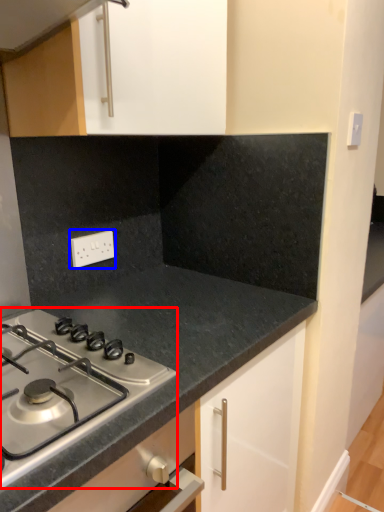
Question: Which point is closer to the camera, gas stove (highlighted by a red box) or electric outlet (highlighted by a blue box)?

Choices:
 (A) gas stove
 (B) electric outlet

Answer: (A)